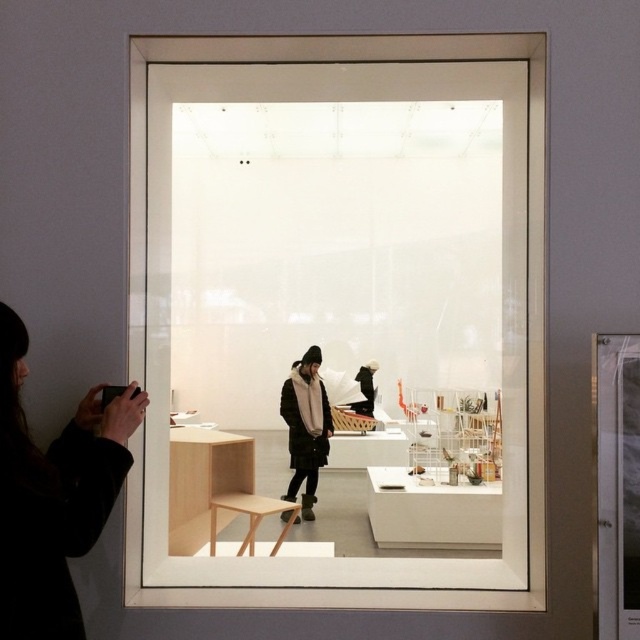
You are standing outside the display and want to take a photo of both the light wood bench at center and the light brown wooden stool at center. Based on their positions, which one is closer to your camera lens?

The light wood bench at center is located above the light brown wooden stool at center, so the light wood bench at center is closer to your camera lens.

You are a photographer standing outside the display case. You want to capture the black fabric at left in your photo. Is the point at coordinates (52, 493) within the area of the black fabric at left?

Yes, the point at coordinates (52, 493) is on the black fabric at left, so it is within the area of the black fabric at left.

You are standing outside the display and want to take a photo of both point [144,259] and point [81,628]. Since you can only focus on one point at a time, which point should you focus on to ensure both points are in focus?

You should focus on point [81,628] because it is closer to you than point [144,259]. By focusing on the closer point, the depth of field will include the farther point as well, ensuring both are in focus.